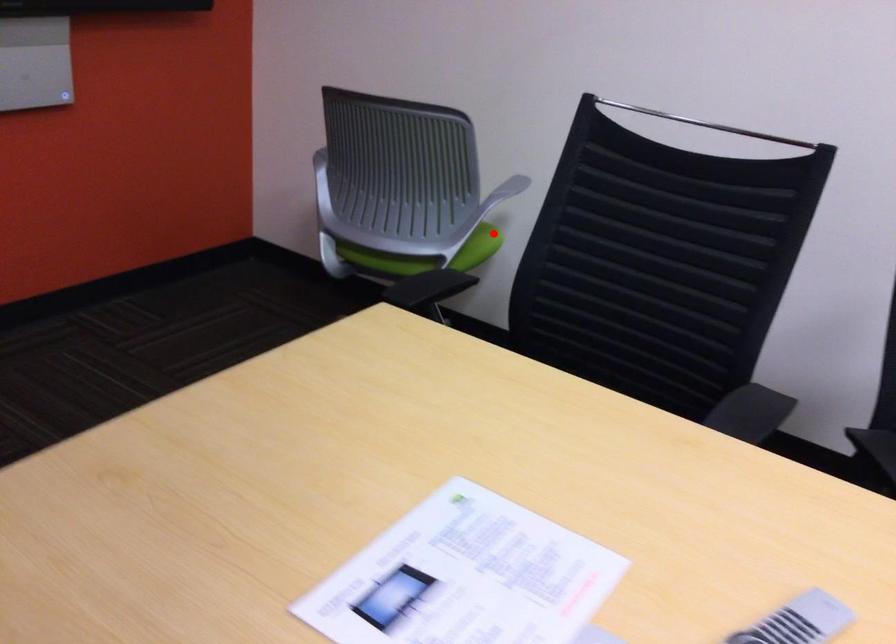
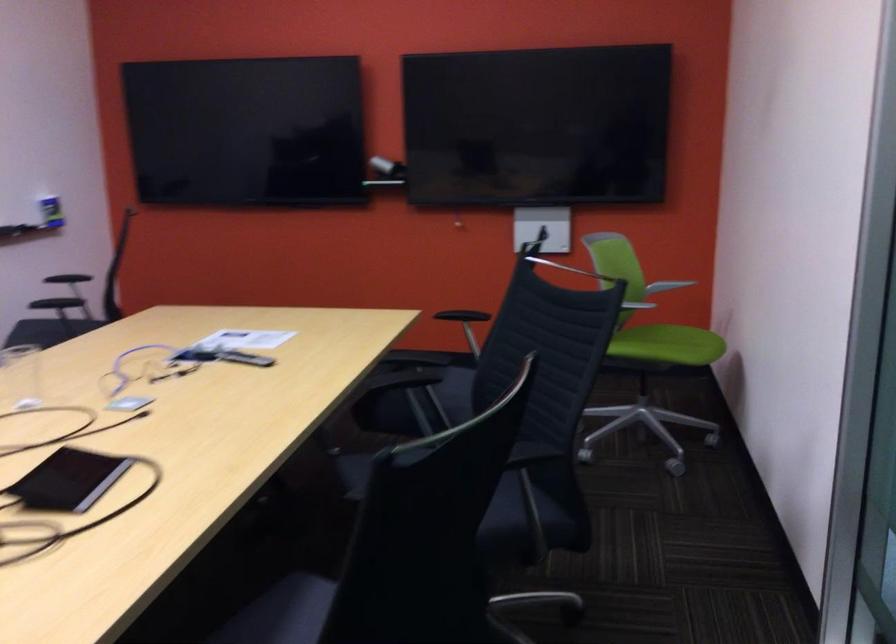
The point at the highlighted location is marked in the first image. Where is the corresponding point in the second image?

(667, 345)